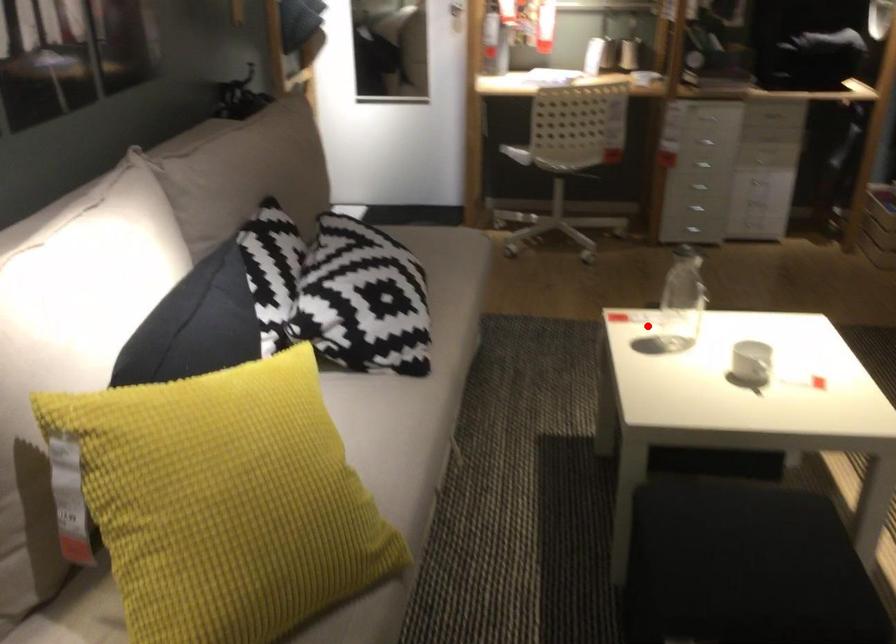
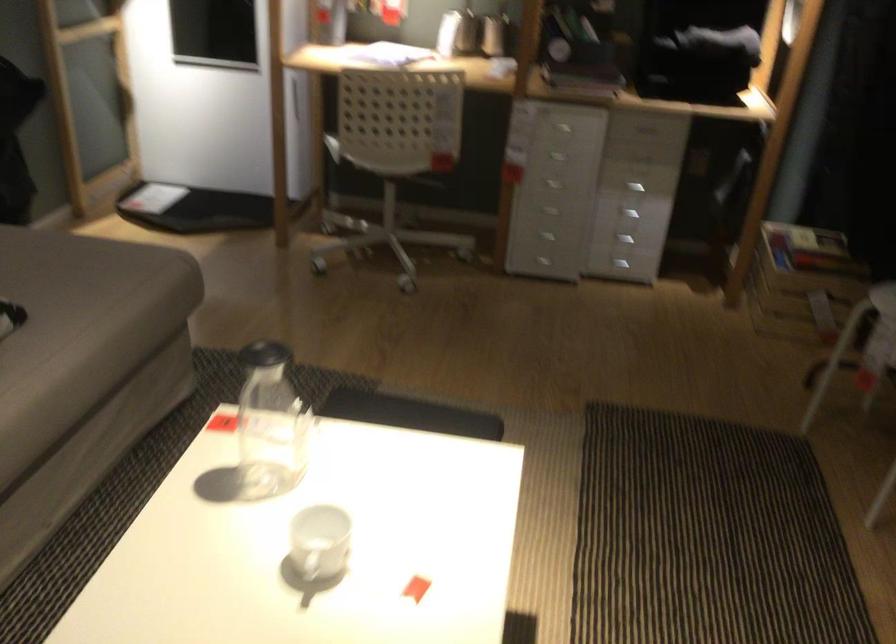
Question: I am providing you with two images of the same scene from different viewpoints. A red point is shown in image1. For the corresponding object point in image2, is it positioned nearer or farther from the camera?

Choices:
 (A) Nearer
 (B) Farther

Answer: (A)